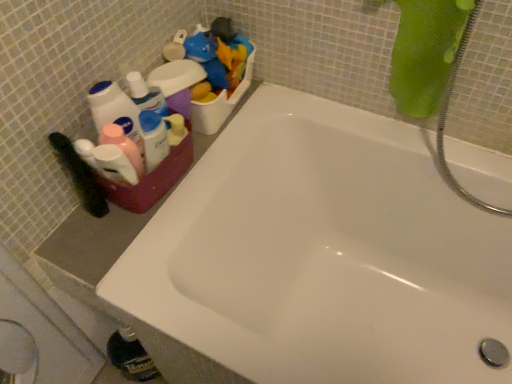
The image size is (512, 384). What do you see at coordinates (322, 254) in the screenshot?
I see `white glossy bathtub at center` at bounding box center [322, 254].

Locate an element on the screen. white glossy bathtub at center is located at coordinates (322, 254).

Locate an element on the screen. The width and height of the screenshot is (512, 384). white glossy bathtub at center is located at coordinates (322, 254).